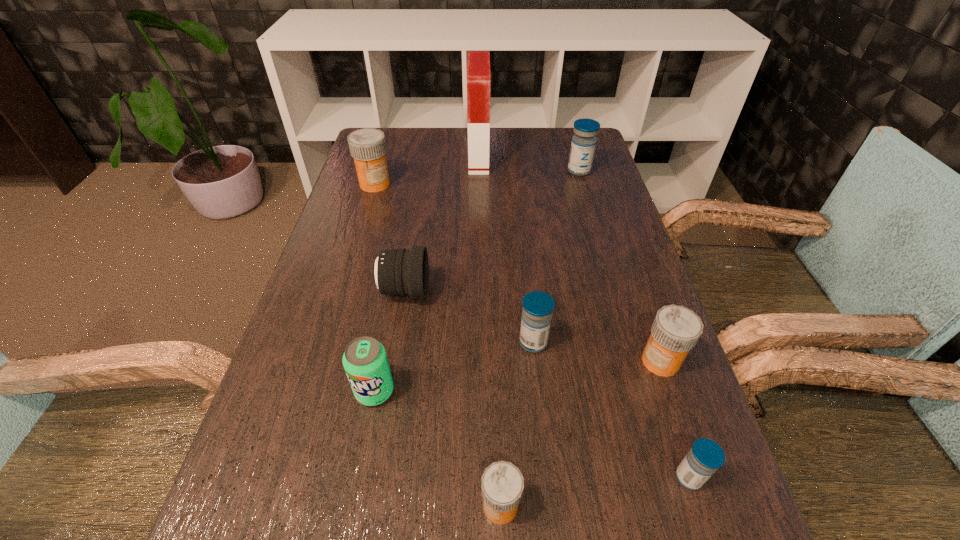
You are a GUI agent. You are given a task and a screenshot of the screen. Output one action in this format:
    pyautogui.click(x=<x>, y=<y>)
    Task: Click on the telephoto lens
    
    Given the screenshot: What is the action you would take?
    pyautogui.click(x=395, y=272)

You are a GUI agent. You are given a task and a screenshot of the screen. Output one action in this format:
    pyautogui.click(x=<x>, y=<y>)
    Task: Click on the fourth farthest object
    
    Given the screenshot: What is the action you would take?
    [x=395, y=272]

At what (x,y) coordinates should I click in order to perform the action: click on the nearest blue medicine. Please return your answer as a coordinate pair (x, y). Looking at the image, I should click on (706, 456).

Find the location of a particular element. The height and width of the screenshot is (540, 960). the second orange medicine from right to left is located at coordinates (502, 483).

Image resolution: width=960 pixels, height=540 pixels. In order to click on the smallest orange medicine in this screenshot , I will do `click(502, 483)`.

Where is `free point located on the front-facing side of the tallest object`? free point located on the front-facing side of the tallest object is located at coordinates (603, 158).

The image size is (960, 540). I want to click on free region located on the back of the biggest blue medicine, so click(573, 150).

You are a GUI agent. You are given a task and a screenshot of the screen. Output one action in this format:
    pyautogui.click(x=<x>, y=<y>)
    Task: Click on the vacant space located on the label side of the biggest orange medicine
    The image size is (960, 540).
    Given the screenshot: What is the action you would take?
    pyautogui.click(x=348, y=272)

You are a GUI agent. You are given a task and a screenshot of the screen. Output one action in this format:
    pyautogui.click(x=<x>, y=<y>)
    Task: Click on the vacant region located 0.170m on the front-facing side of the pop soda
    The height and width of the screenshot is (540, 960).
    Given the screenshot: What is the action you would take?
    pyautogui.click(x=351, y=512)

You are a GUI agent. You are given a task and a screenshot of the screen. Output one action in this format:
    pyautogui.click(x=<x>, y=<y>)
    Task: Click on the vacant space located on the front of the fourth object from right to left
    This screenshot has width=960, height=540.
    Given the screenshot: What is the action you would take?
    pyautogui.click(x=544, y=450)